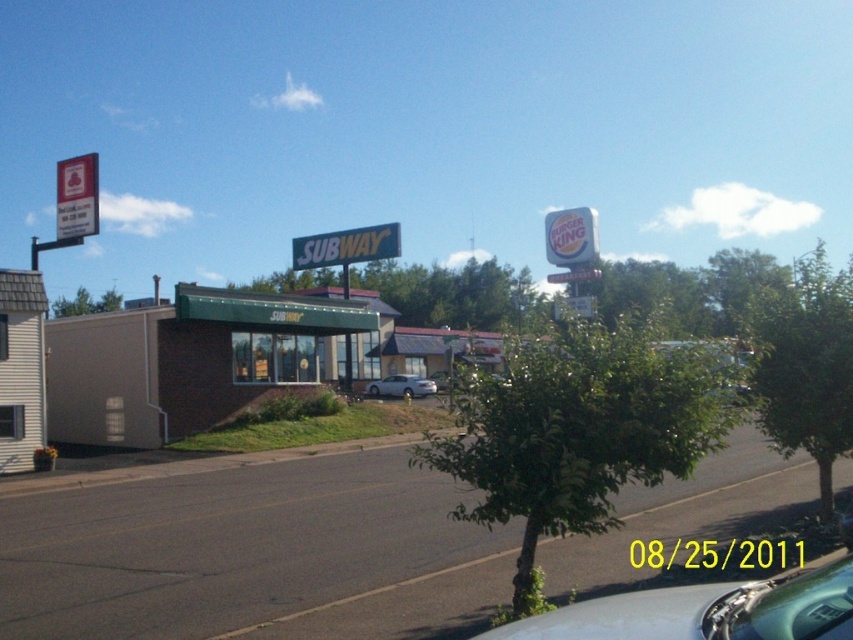
You are a delivery driver who needs to park your car between the Subway and Burger King restaurants. You see a metallic silver car at center and a silver metallic sedan at center. Which car is closer to the Subway restaurant?

The silver metallic sedan at center is closer to the Subway restaurant because it is to the left of the metallic silver car at center.

You are a delivery driver who needs to park your metallic silver car at center in the street scene. The parking spot is located at coordinate point 0.956, 0.829. Can you safely park your car there?

The metallic silver car at center is already located at the specified coordinate point (706, 611), so it is already parked there safely.

You are a delivery driver who needs to park your metallic silver car at center in the parking lot near the Subway restaurant. Based on the image, can you confirm if there is space available for your car?

The metallic silver car at center is located at point coordinates (706, 611), which is near the Subway restaurant. There is a small parking lot in front of the Subway restaurant with a white car parked near the entrance. Since there is already a white car parked there, there might be limited space available for your metallic silver car at center. Please check the parking lot for available spots before proceeding.